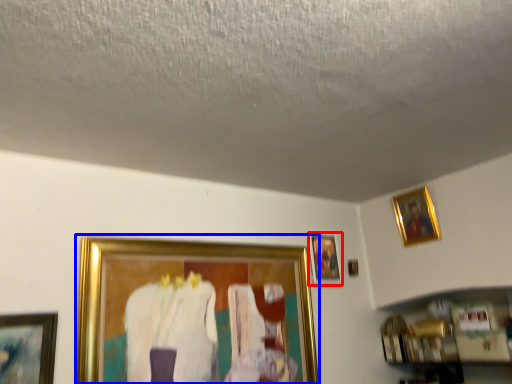
Question: Which object appears closest to the camera in this image, picture frame (highlighted by a red box) or picture frame (highlighted by a blue box)?

Choices:
 (A) picture frame
 (B) picture frame

Answer: (B)